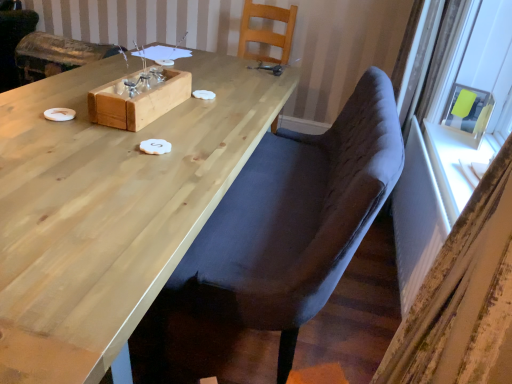
Where is `free spot above natural wood table at center (from a real-world perspective)`? free spot above natural wood table at center (from a real-world perspective) is located at coordinates (133, 135).